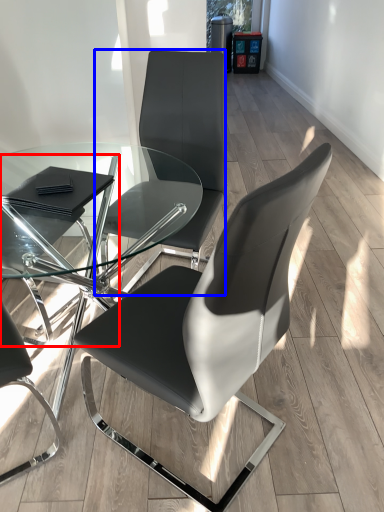
Question: Which object is further to the camera taking this photo, chair (highlighted by a red box) or chair (highlighted by a blue box)?

Choices:
 (A) chair
 (B) chair

Answer: (B)